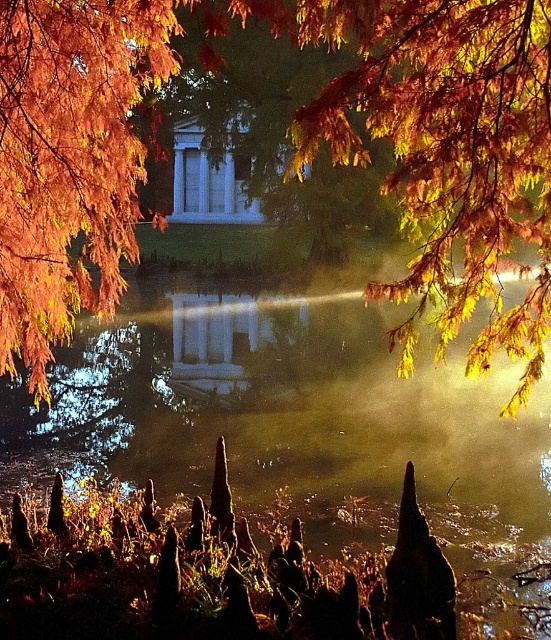
Question: Is orange leafy branch at upper left to the left of white marble gazebo at center from the viewer's perspective?

Choices:
 (A) no
 (B) yes

Answer: (A)

Question: Observing the image, what is the correct spatial positioning of orange matte leaves at upper left in reference to white marble gazebo at center?

Choices:
 (A) below
 (B) above

Answer: (A)

Question: Among these points, which one is farthest from the camera?

Choices:
 (A) pos(78,193)
 (B) pos(244,195)

Answer: (B)

Question: Is orange leafy branch at upper left wider than orange matte leaves at upper left?

Choices:
 (A) yes
 (B) no

Answer: (A)

Question: Among these points, which one is nearest to the camera?

Choices:
 (A) (126, 106)
 (B) (12, 125)

Answer: (B)

Question: Estimate the real-world distances between objects in this image. Which object is farther from the orange leafy branch at upper left?

Choices:
 (A) orange matte leaves at upper left
 (B) white marble gazebo at center

Answer: (B)